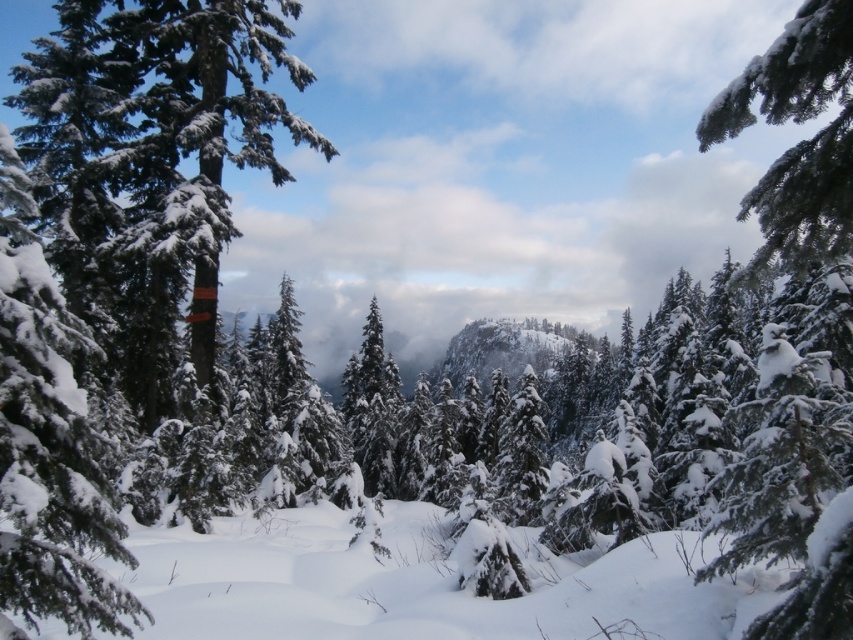
Question: Is white fluffy snow at center closer to the viewer compared to white fluffy snow-covered branch at upper right?

Choices:
 (A) no
 (B) yes

Answer: (A)

Question: Can you confirm if white fluffy snow at center is wider than white fluffy snow-covered branch at upper right?

Choices:
 (A) yes
 (B) no

Answer: (B)

Question: Is white fluffy snow at center thinner than white fluffy snow-covered branch at upper right?

Choices:
 (A) no
 (B) yes

Answer: (B)

Question: Which of the following is the closest to the observer?

Choices:
 (A) (659, 584)
 (B) (819, 195)

Answer: (B)